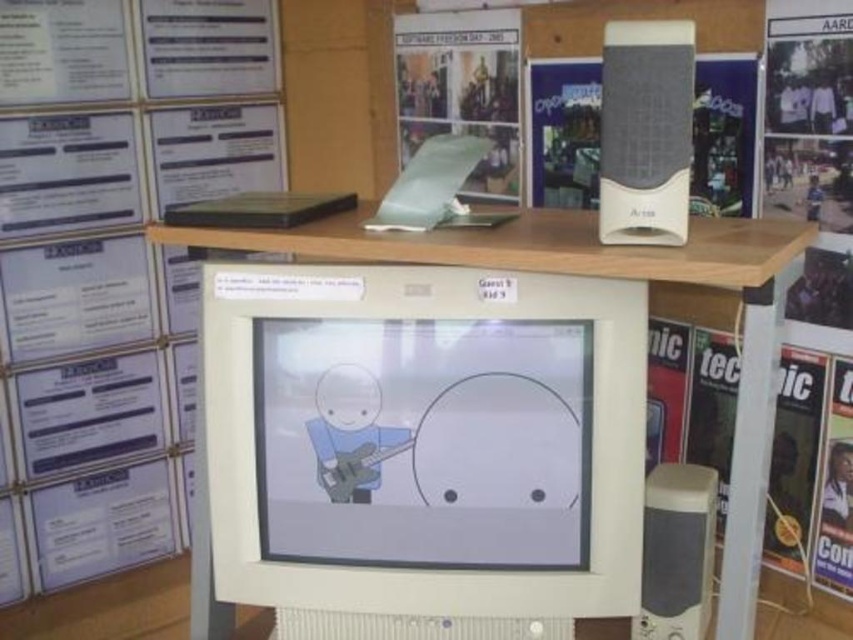
You are organizing items on a desk and need to place a new item between the white paper at upper left and the white plastic speaker at lower right. Based on their positions, where should you place the new item?

The white paper at upper left is above the white plastic speaker at lower right, so you should place the new item in between them somewhere along the vertical axis between the two objects.

You are setting up a new monitor on the desk and need to place the white plastic speaker at upper right and the white plastic speaker at lower right symmetrically. Which speaker should be placed closer to the top of the desk to maintain symmetry?

The white plastic speaker at upper right should be placed closer to the top of the desk because it is shorter than the white plastic speaker at lower right, ensuring both speakers are at the same height when viewed from the front.